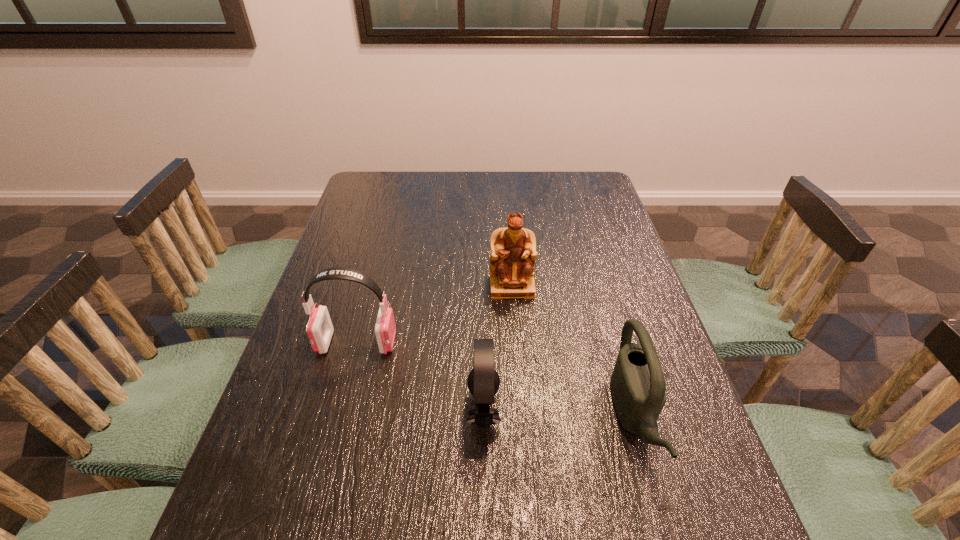
Find the location of a particular element. The height and width of the screenshot is (540, 960). the leftmost object is located at coordinates click(319, 329).

What are the coordinates of `the second farthest object` in the screenshot? It's located at (319, 329).

This screenshot has width=960, height=540. Identify the location of figurine. (513, 252).

Image resolution: width=960 pixels, height=540 pixels. What are the coordinates of `the shorter earphone` in the screenshot? It's located at (483, 381).

Find the location of `the nearer earphone`. the nearer earphone is located at coordinates (483, 381).

The width and height of the screenshot is (960, 540). In order to click on the rightmost object in this screenshot , I will do [637, 383].

This screenshot has height=540, width=960. What are the coordinates of `blank area located 0.320m on the outer surface of the leftmost object` in the screenshot? It's located at [x=527, y=343].

Locate an element on the screen. This screenshot has height=540, width=960. vacant space located 0.250m on the front-facing side of the farthest object is located at coordinates (519, 378).

Identify the location of vacant space located on the ear cups of the right earphone. (434, 409).

In order to click on vacant space located 0.160m on the ear cups of the right earphone in this screenshot , I will do `click(391, 409)`.